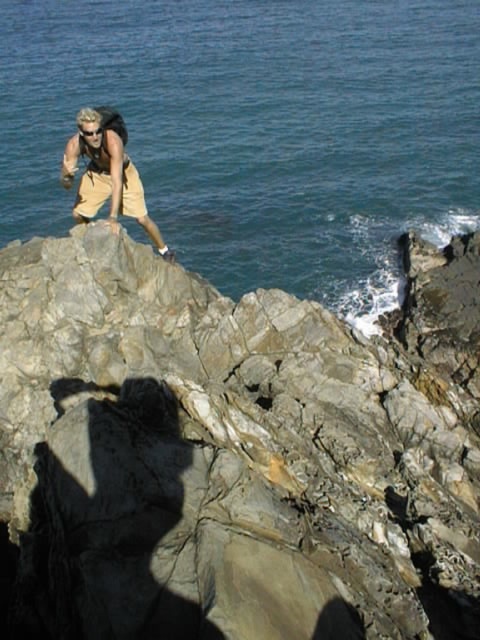
You are a hiker who wants to know if the blue water at upper center is higher or lower than the tan cotton shorts at upper left. Based on the scene, can you determine this?

The blue water at upper center is much taller than the tan cotton shorts at upper left, so the water is higher than the shorts.